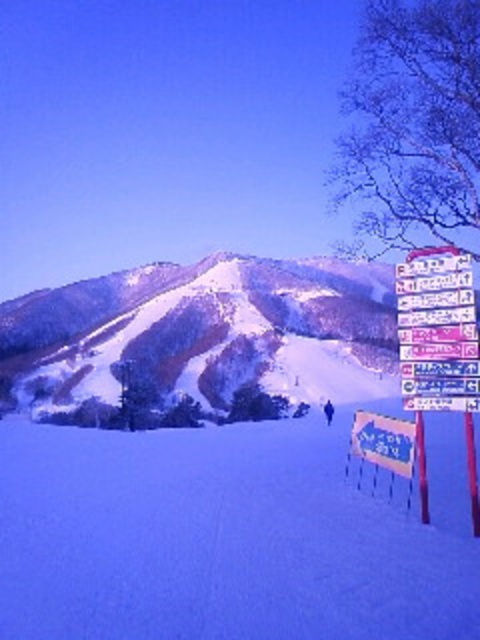
Question: Which object is closer to the camera taking this photo?

Choices:
 (A) white plastic sign at right
 (B) white snow-covered mountain at upper center
 (C) white snow ski slope at lower left

Answer: (C)

Question: Does white snow ski slope at lower left appear over white plastic sign at right?

Choices:
 (A) yes
 (B) no

Answer: (B)

Question: Where is white snow-covered mountain at upper center located in relation to blue plastic sign at lower right in the image?

Choices:
 (A) left
 (B) right

Answer: (A)

Question: Which object is the closest to the white plastic sign at right?

Choices:
 (A) white snow ski slope at lower left
 (B) white snow-covered mountain at upper center

Answer: (A)

Question: Which of the following is the farthest from the observer?

Choices:
 (A) (397, 451)
 (B) (146, 497)
 (C) (423, 397)

Answer: (B)

Question: Is white snow ski slope at lower left wider than blue plastic sign at lower right?

Choices:
 (A) yes
 (B) no

Answer: (A)